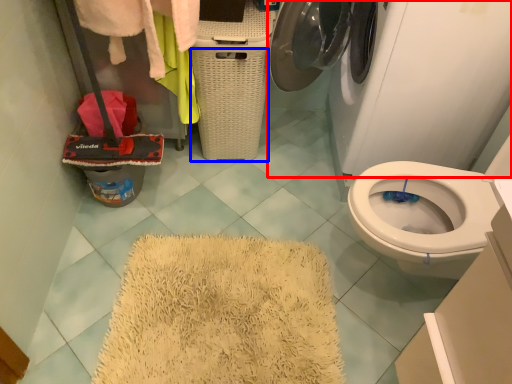
Question: Which point is closer to the camera, washing machine (highlighted by a red box) or basket (highlighted by a blue box)?

Choices:
 (A) washing machine
 (B) basket

Answer: (A)